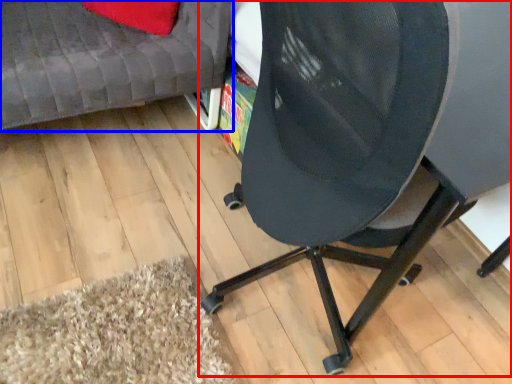
Question: Which point is further to the camera, chair (highlighted by a red box) or furniture (highlighted by a blue box)?

Choices:
 (A) chair
 (B) furniture

Answer: (B)